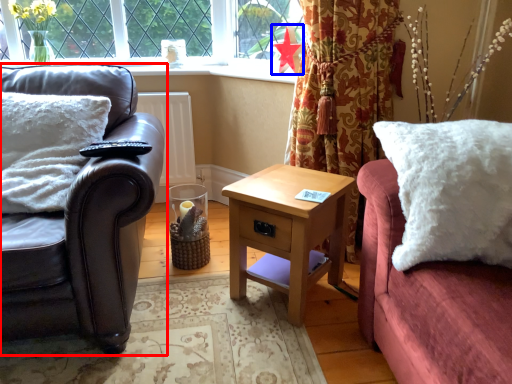
Question: Which point is further to the camera, studio couch (highlighted by a red box) or flower (highlighted by a blue box)?

Choices:
 (A) studio couch
 (B) flower

Answer: (B)